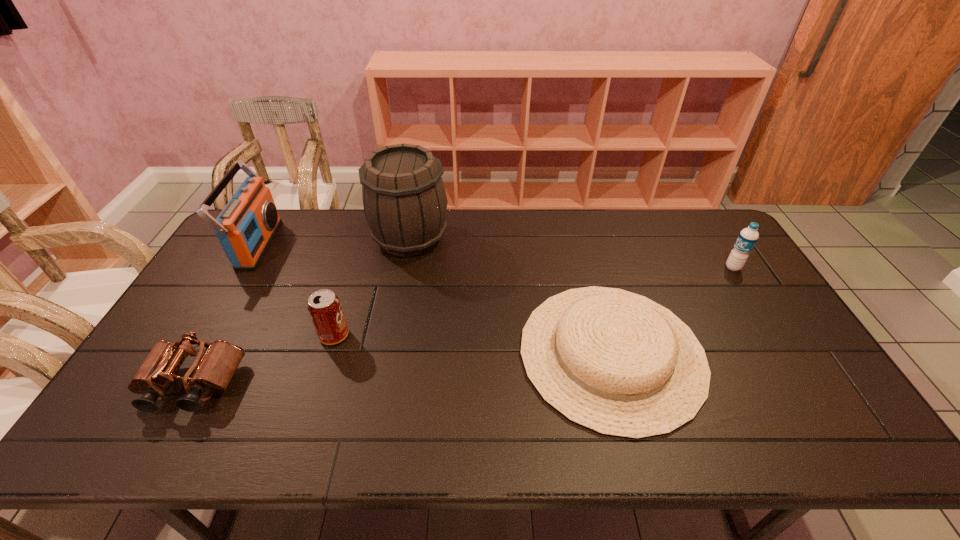
Find the location of a particular element. This screenshot has height=540, width=960. free spot between the soda can and the tallest object is located at coordinates (372, 287).

You are a GUI agent. You are given a task and a screenshot of the screen. Output one action in this format:
    pyautogui.click(x=<x>, y=<y>)
    Task: Click on the free spot between the wine bucket and the rightmost object
    
    Given the screenshot: What is the action you would take?
    pyautogui.click(x=571, y=253)

This screenshot has height=540, width=960. Identify the location of vacant area between the rightmost object and the radio receiver. (495, 256).

Locate an element on the screen. Image resolution: width=960 pixels, height=540 pixels. free spot between the fourth tallest object and the radio receiver is located at coordinates (297, 290).

This screenshot has height=540, width=960. I want to click on empty location between the second tallest object and the sunhat, so click(435, 299).

Image resolution: width=960 pixels, height=540 pixels. Identify the location of vacant space that's between the fifth shortest object and the soda can. (297, 290).

The image size is (960, 540). What are the coordinates of `free spot between the tallest object and the water bottle` in the screenshot? It's located at (571, 253).

Identify the location of empty space that is in between the radio receiver and the shortest object. (435, 299).

Find the location of a particular element. vacant point located between the radio receiver and the sunhat is located at coordinates (435, 299).

Identify which object is the fifth closest to the second object from right to left. Please provide its 2D coordinates. Your answer should be formatted as a tuple, i.e. [(x, y)], where the tuple contains the x and y coordinates of a point satisfying the conditions above.

[(246, 226)]